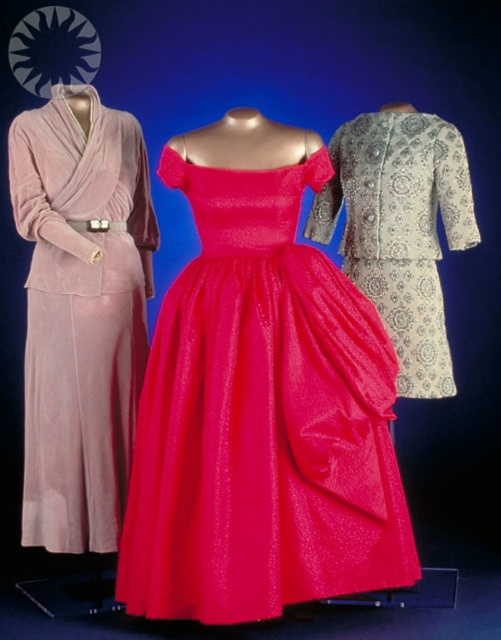
Question: Which of the following is the farthest from the observer?

Choices:
 (A) (384, 189)
 (B) (168, 168)
 (C) (40, 364)

Answer: (A)

Question: Among these objects, which one is farthest from the camera?

Choices:
 (A) silver metallic dress at right
 (B) shiny taffeta dress at center
 (C) velvet pink dress at left

Answer: (A)

Question: Is velvet pink dress at left positioned in front of silver metallic dress at right?

Choices:
 (A) yes
 (B) no

Answer: (A)

Question: Which point is closer to the camera?

Choices:
 (A) shiny taffeta dress at center
 (B) velvet pink dress at left
 (C) silver metallic dress at right

Answer: (A)

Question: Can you confirm if velvet pink dress at left is bigger than silver metallic dress at right?

Choices:
 (A) yes
 (B) no

Answer: (A)

Question: Can you confirm if velvet pink dress at left is positioned above silver metallic dress at right?

Choices:
 (A) yes
 (B) no

Answer: (B)